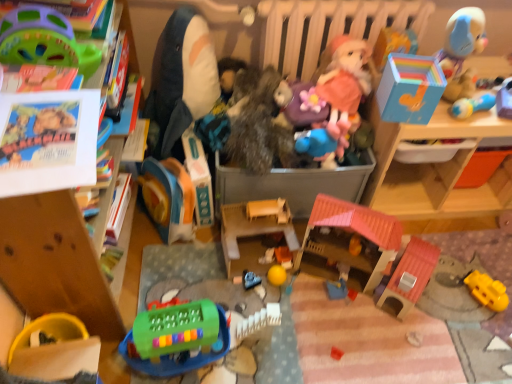
Where is `vacant space in front of smooth orange block at center, arranged as the seventh toy when viewed from the right`? This screenshot has width=512, height=384. vacant space in front of smooth orange block at center, arranged as the seventh toy when viewed from the right is located at coordinates click(x=284, y=302).